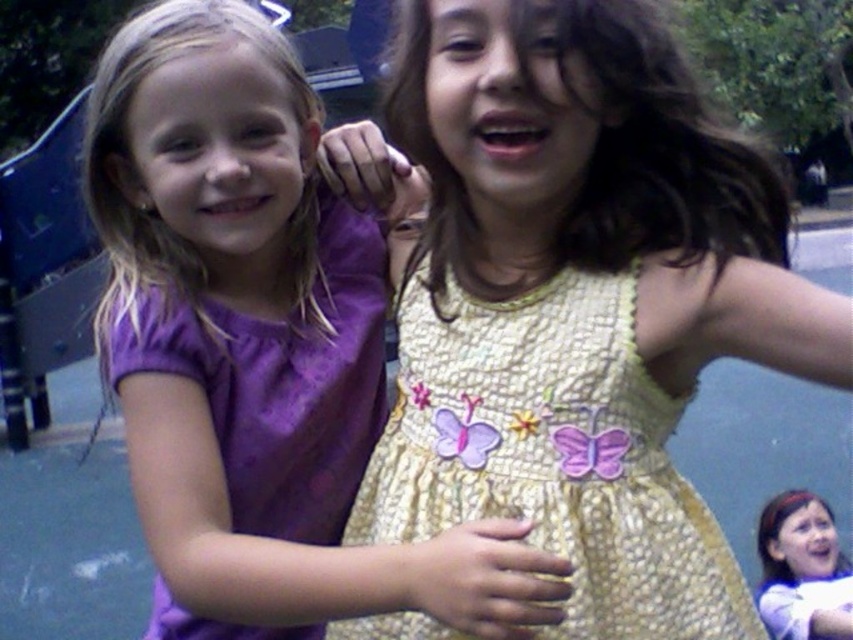
Who is lower down, yellow textured dress at center or matte purple dress at center?

matte purple dress at center

Who is positioned more to the left, yellow textured dress at center or matte purple dress at center?

From the viewer's perspective, yellow textured dress at center appears more on the left side.

Between point (428, 520) and point (787, 563), which one is positioned behind?

The point (787, 563) is more distant.

I want to click on yellow textured dress at center, so click(x=552, y=454).

Is purple satin dress at center positioned in front of matte purple dress at center?

Yes, it is in front of matte purple dress at center.

Is purple satin dress at center bigger than matte purple dress at center?

Yes, purple satin dress at center is bigger than matte purple dress at center.

Find the location of a particular element. Image resolution: width=853 pixels, height=640 pixels. purple satin dress at center is located at coordinates (256, 348).

This screenshot has width=853, height=640. I want to click on purple satin dress at center, so click(256, 348).

In order to click on purple satin dress at center in this screenshot , I will do `click(256, 348)`.